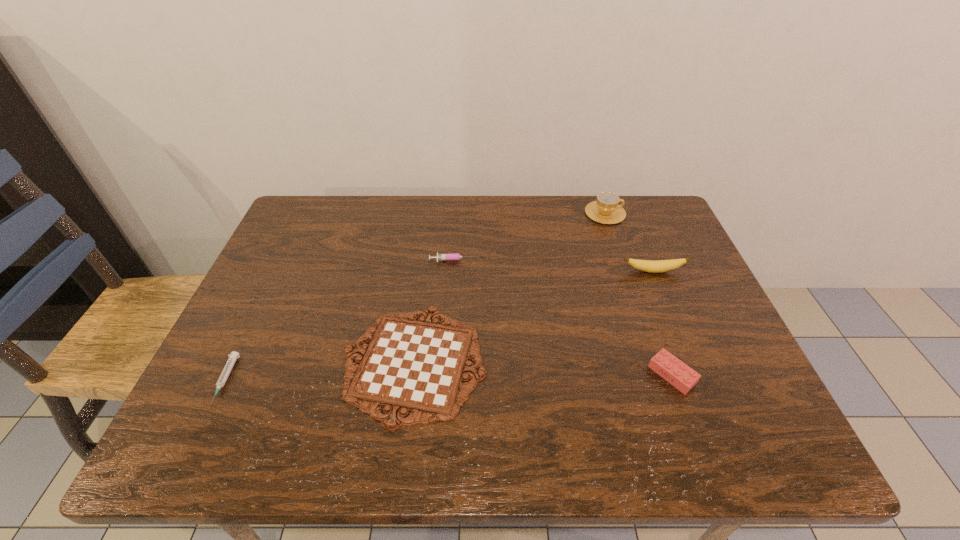
Identify the location of vacant region that satisfies the following two spatial constraints: 1. with the handle on the side of the Lego; 2. on the right side of the farthest object. Image resolution: width=960 pixels, height=540 pixels. (660, 375).

At what (x,y) coordinates should I click in order to perform the action: click on free region that satisfies the following two spatial constraints: 1. with the handle on the side of the cup; 2. at the needle end of the leftmost object. Please return your answer as a coordinate pair (x, y). This screenshot has height=540, width=960. Looking at the image, I should click on (662, 380).

The width and height of the screenshot is (960, 540). What are the coordinates of `vacant region that satisfies the following two spatial constraints: 1. with the handle on the side of the banana; 2. on the left side of the cup` in the screenshot? It's located at (625, 271).

This screenshot has height=540, width=960. I want to click on free spot that satisfies the following two spatial constraints: 1. with the handle on the side of the fourth shortest object; 2. on the right side of the cup, so click(660, 375).

This screenshot has height=540, width=960. I want to click on free location that satisfies the following two spatial constraints: 1. with the handle on the side of the cup; 2. at the needle end of the leftmost object, so click(662, 380).

Find the location of a particular element. The width and height of the screenshot is (960, 540). free spot that satisfies the following two spatial constraints: 1. with the handle on the side of the farthest object; 2. on the back side of the Lego is located at coordinates (660, 375).

You are a GUI agent. You are given a task and a screenshot of the screen. Output one action in this format:
    pyautogui.click(x=<x>, y=<y>)
    Task: Click on the vacant space that satisfies the following two spatial constraints: 1. with the handle on the side of the farthest object; 2. on the right side of the fifth shortest object
    
    Given the screenshot: What is the action you would take?
    pyautogui.click(x=625, y=271)

Locate an element on the screen. The image size is (960, 540). vacant space that satisfies the following two spatial constraints: 1. with the handle on the side of the farthest object; 2. on the right side of the Lego is located at coordinates (660, 375).